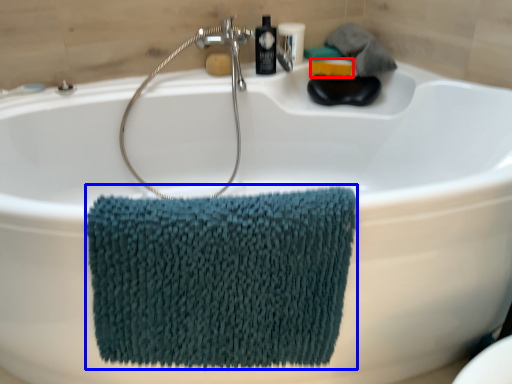
Question: Which point is closer to the camera, soap (highlighted by a red box) or bath towel (highlighted by a blue box)?

Choices:
 (A) soap
 (B) bath towel

Answer: (B)